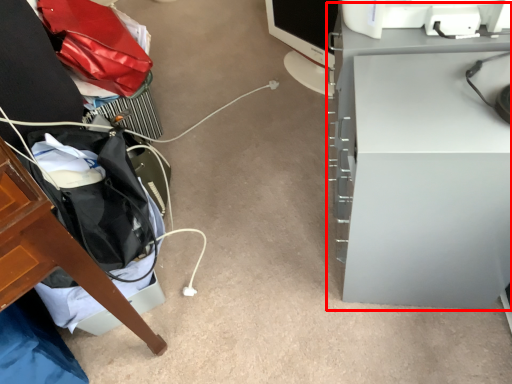
Question: From the image, what is the correct spatial relationship of computer desk (annotated by the red box) in relation to computer monitor?

Choices:
 (A) left
 (B) right

Answer: (B)